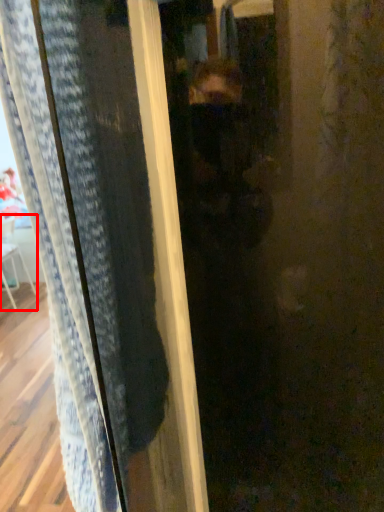
Question: In this image, where is armchair (annotated by the red box) located relative to screen door?

Choices:
 (A) right
 (B) left

Answer: (B)